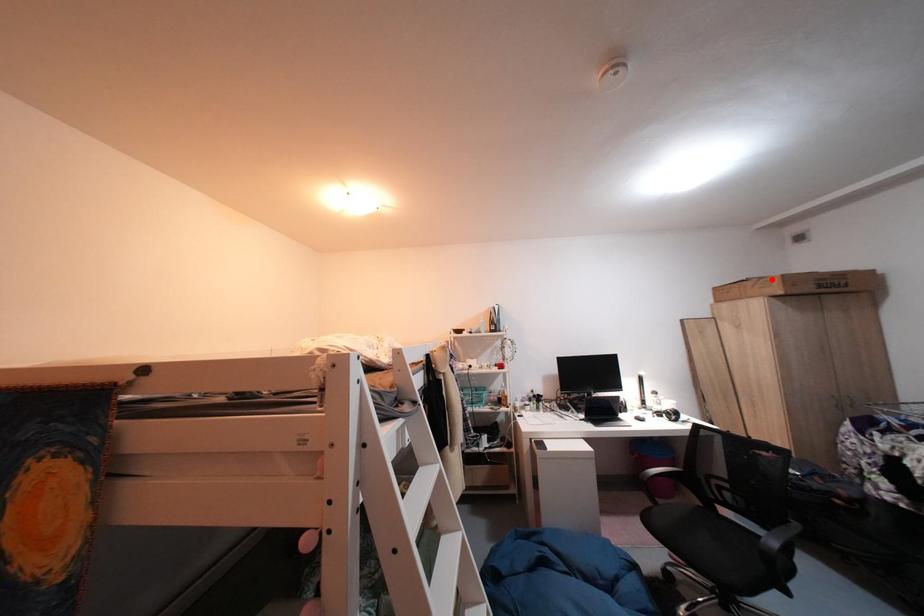
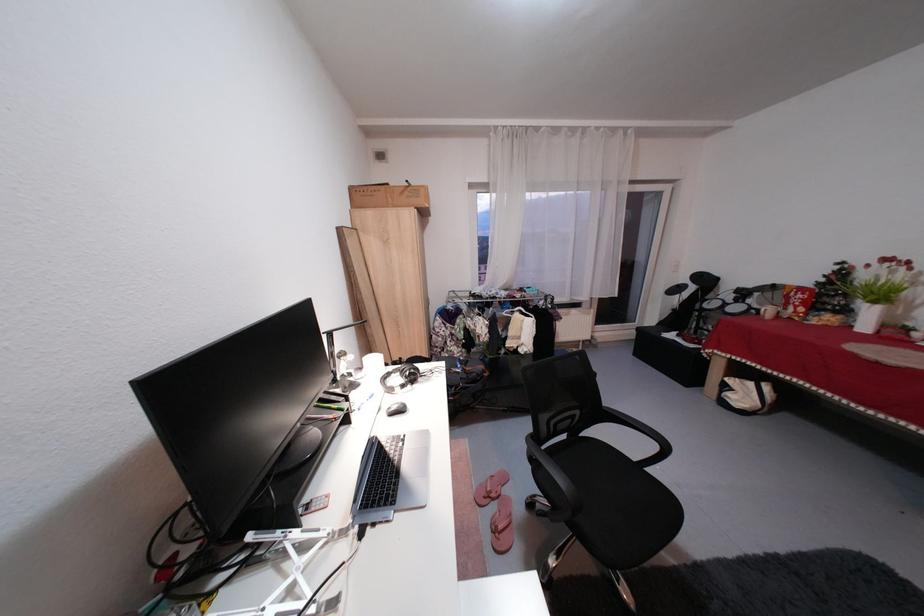
Find the pixel in the second image that matches the highlighted location in the first image.

(420, 185)